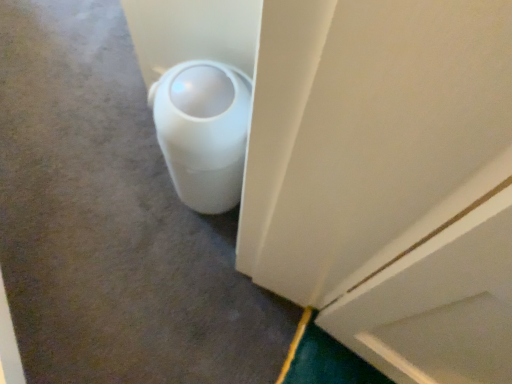
Image resolution: width=512 pixels, height=384 pixels. Identify the location of white matte toilet at lower left. (203, 131).

What do you see at coordinates (203, 131) in the screenshot? The height and width of the screenshot is (384, 512). I see `white matte toilet at lower left` at bounding box center [203, 131].

This screenshot has width=512, height=384. Find the location of `white matte toilet at lower left`. white matte toilet at lower left is located at coordinates (203, 131).